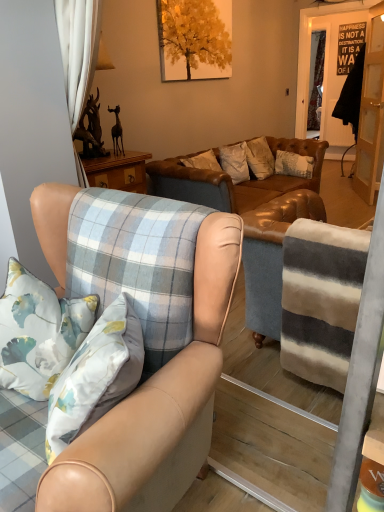
Question: Can you confirm if white floral pillow at left is positioned to the right of leather couch at center?

Choices:
 (A) no
 (B) yes

Answer: (A)

Question: Is leather couch at center located within white floral pillow at left?

Choices:
 (A) no
 (B) yes

Answer: (A)

Question: Does white floral pillow at left have a larger size compared to leather couch at center?

Choices:
 (A) no
 (B) yes

Answer: (A)

Question: Is white floral pillow at left positioned in front of leather couch at center?

Choices:
 (A) yes
 (B) no

Answer: (A)

Question: Is white floral pillow at left at the left side of leather couch at center?

Choices:
 (A) yes
 (B) no

Answer: (A)

Question: Do you think light brown leather armchair at center is within white floral pillow at left, or outside of it?

Choices:
 (A) outside
 (B) inside

Answer: (A)

Question: From the image's perspective, is light brown leather armchair at center located above or below white floral pillow at left?

Choices:
 (A) below
 (B) above

Answer: (A)

Question: Is point (61, 478) closer or farther from the camera than point (62, 360)?

Choices:
 (A) farther
 (B) closer

Answer: (B)

Question: Looking at the image, does light brown leather armchair at center seem bigger or smaller compared to white floral pillow at left?

Choices:
 (A) big
 (B) small

Answer: (A)

Question: In terms of width, does light brown leather armchair at center look wider or thinner when compared to leather couch at center?

Choices:
 (A) wide
 (B) thin

Answer: (B)

Question: Is light brown leather armchair at center taller or shorter than leather couch at center?

Choices:
 (A) tall
 (B) short

Answer: (A)

Question: Considering the positions of point (92, 482) and point (317, 202), is point (92, 482) closer or farther from the camera than point (317, 202)?

Choices:
 (A) farther
 (B) closer

Answer: (B)

Question: From a real-world perspective, is light brown leather armchair at center physically located above or below leather couch at center?

Choices:
 (A) below
 (B) above

Answer: (B)

Question: Considering the relative positions of leather couch at center and clear glass door at right in the image provided, is leather couch at center to the left or to the right of clear glass door at right?

Choices:
 (A) left
 (B) right

Answer: (A)

Question: Is point (251, 281) positioned closer to the camera than point (359, 158)?

Choices:
 (A) closer
 (B) farther

Answer: (A)